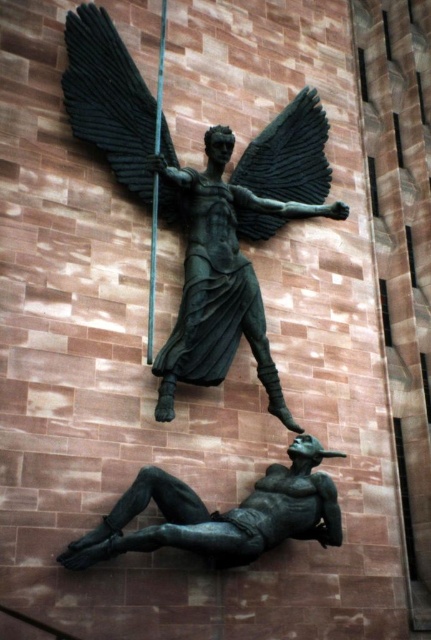
Question: Is bronze figure at lower center further to camera compared to green patina spear at upper center?

Choices:
 (A) yes
 (B) no

Answer: (B)

Question: Considering the real-world distances, which object is closest to the black matte wing at upper center?

Choices:
 (A) shiny bronze wings at upper center
 (B) bronze figure at lower center
 (C) green patina spear at upper center

Answer: (C)

Question: Which is farther from the bronze figure at lower center?

Choices:
 (A) shiny bronze wings at upper center
 (B) green patina spear at upper center
 (C) bronze statue at upper center

Answer: (A)

Question: Does bronze figure at lower center come in front of black matte wing at upper center?

Choices:
 (A) no
 (B) yes

Answer: (B)

Question: Can you confirm if bronze statue at upper center is wider than shiny bronze wings at upper center?

Choices:
 (A) no
 (B) yes

Answer: (B)

Question: Which of these objects is positioned closest to the shiny bronze wings at upper center?

Choices:
 (A) black matte wing at upper center
 (B) bronze statue at upper center
 (C) green patina spear at upper center
 (D) bronze figure at lower center

Answer: (B)